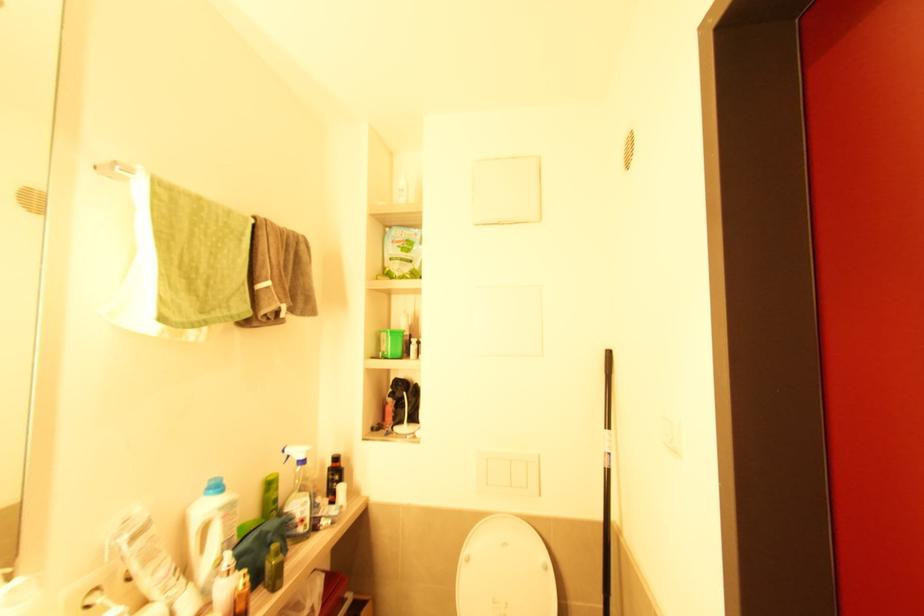
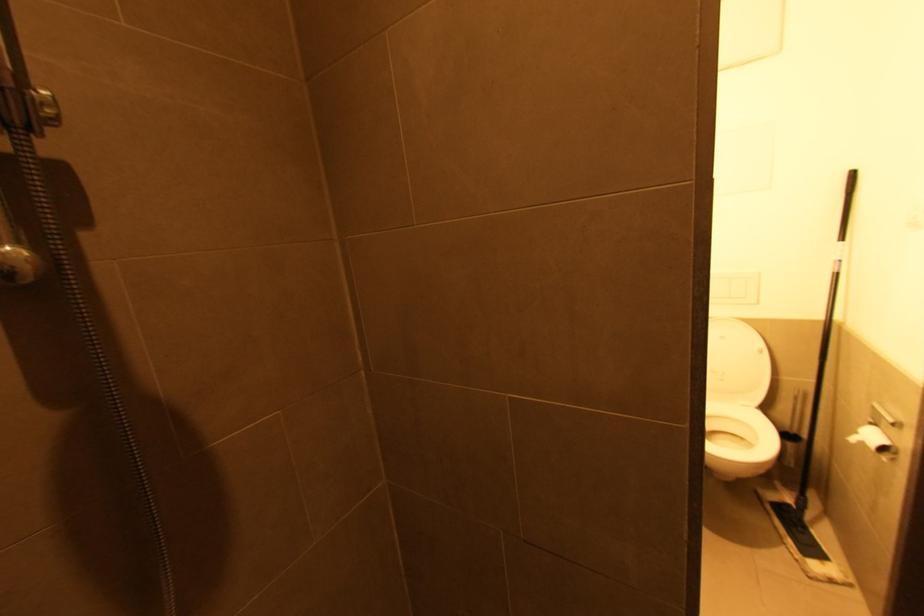
How did the camera likely rotate?

The camera's rotation is toward left-down.